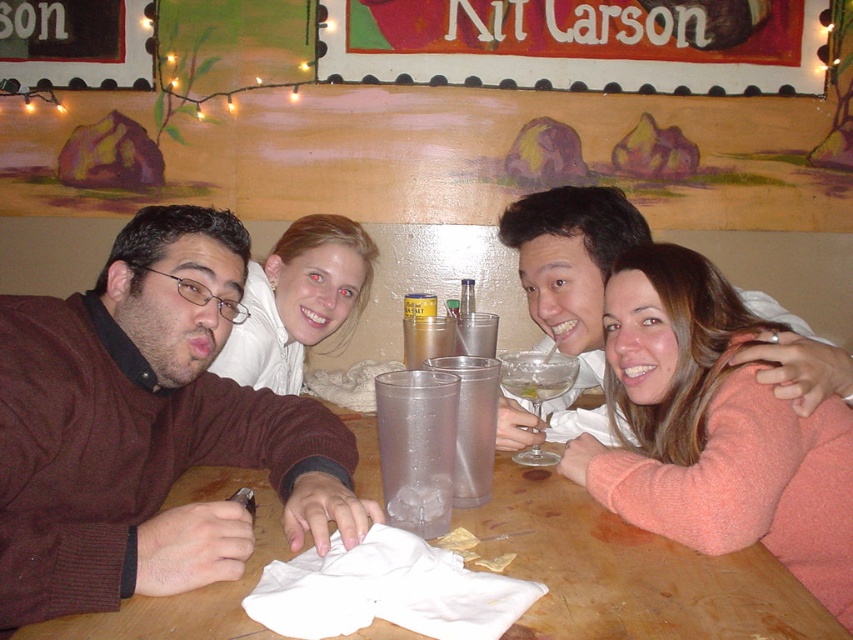
Does point (202, 403) lie behind point (439, 353)?

That is False.

At what (x,y) coordinates should I click in order to perform the action: click on brown sweater at left. Please return your answer as a coordinate pair (x, y). Looking at the image, I should click on (148, 429).

Does point (171, 564) come farther from viewer compared to point (448, 349)?

No, it is not.

The image size is (853, 640). I want to click on brown sweater at left, so click(148, 429).

Is brown sweater at left behind clear plastic cup at table center?

No, it is not.

Between point (123, 529) and point (415, 461), which one is positioned in front?

Point (123, 529) is in front.

Locate an element on the screen. brown sweater at left is located at coordinates (148, 429).

Find the location of `brown sweater at left`. brown sweater at left is located at coordinates [x=148, y=429].

In the scene shown: Does brown sweater at left have a greater height compared to smooth white blouse at upper center?

Yes.

Who is taller, brown sweater at left or smooth white blouse at upper center?

brown sweater at left is taller.

Describe the element at coordinates (148, 429) in the screenshot. I see `brown sweater at left` at that location.

Image resolution: width=853 pixels, height=640 pixels. I want to click on brown sweater at left, so click(x=148, y=429).